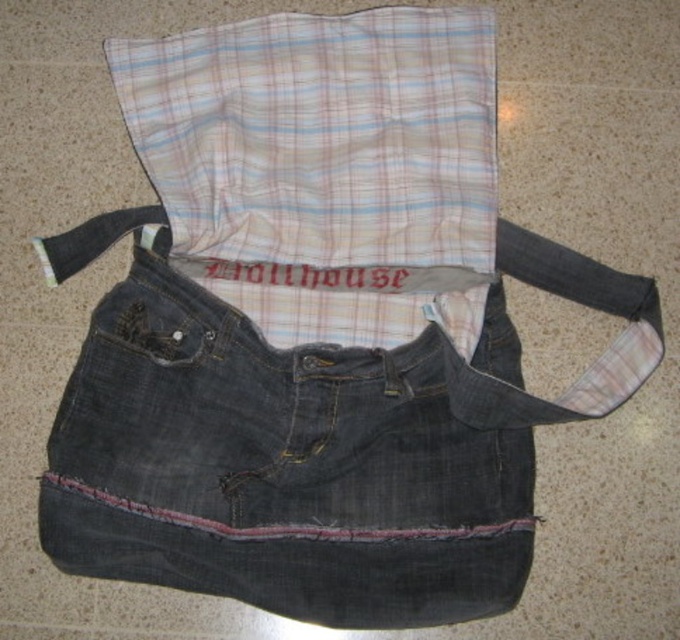
Question: Can you confirm if denim at center is positioned to the left of denim strap at center?

Choices:
 (A) yes
 (B) no

Answer: (A)

Question: Based on their relative distances, which object is farther from the denim at center?

Choices:
 (A) denim strap at center
 (B) plaid fabric at center

Answer: (B)

Question: Estimate the real-world distances between objects in this image. Which object is closer to the denim at center?

Choices:
 (A) plaid fabric at center
 (B) denim strap at center

Answer: (B)

Question: Does denim at center appear on the left side of plaid fabric at center?

Choices:
 (A) no
 (B) yes

Answer: (B)

Question: Which point is closer to the camera taking this photo?

Choices:
 (A) (636, 339)
 (B) (471, 292)

Answer: (A)

Question: Is denim at center above plaid fabric at center?

Choices:
 (A) yes
 (B) no

Answer: (B)